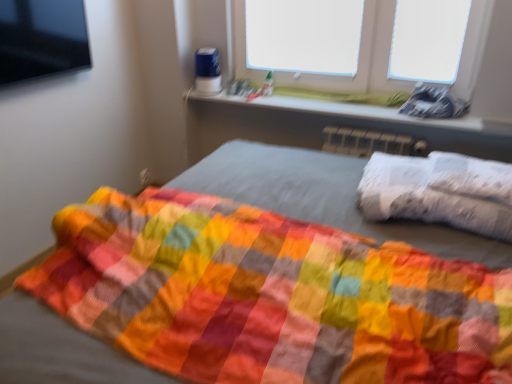
Question: Can you confirm if white matte window screen at upper center, the first window screen when ordered from left to right, is positioned to the left of white textured pillow at right?

Choices:
 (A) no
 (B) yes

Answer: (B)

Question: Is white matte window screen at upper center, the first window screen when ordered from left to right, bigger than white textured pillow at right?

Choices:
 (A) yes
 (B) no

Answer: (B)

Question: Does white matte window screen at upper center, the second window screen viewed from the right, come in front of white textured pillow at right?

Choices:
 (A) no
 (B) yes

Answer: (A)

Question: Is white matte window screen at upper center, the second window screen viewed from the right, completely or partially outside of white textured pillow at right?

Choices:
 (A) yes
 (B) no

Answer: (A)

Question: Is white matte window screen at upper center, the first window screen when ordered from left to right, touching white textured pillow at right?

Choices:
 (A) no
 (B) yes

Answer: (A)

Question: From the image's perspective, would you say white matte window screen at upper center, the second window screen viewed from the right, is shown under white textured pillow at right?

Choices:
 (A) yes
 (B) no

Answer: (B)

Question: Considering the relative sizes of white plastic window sill at upper center and white matte window screen at upper center, the second window screen viewed from the right, in the image provided, is white plastic window sill at upper center bigger than white matte window screen at upper center, the second window screen viewed from the right,?

Choices:
 (A) no
 (B) yes

Answer: (B)

Question: From the image's perspective, is white plastic window sill at upper center beneath white matte window screen at upper center, the first window screen when ordered from left to right?

Choices:
 (A) yes
 (B) no

Answer: (A)

Question: From a real-world perspective, is white plastic window sill at upper center on top of white matte window screen at upper center, the second window screen viewed from the right?

Choices:
 (A) yes
 (B) no

Answer: (B)

Question: Does white plastic window sill at upper center appear on the right side of white matte window screen at upper center, the first window screen when ordered from left to right?

Choices:
 (A) no
 (B) yes

Answer: (B)

Question: Is white plastic window sill at upper center thinner than white matte window screen at upper center, the second window screen viewed from the right?

Choices:
 (A) no
 (B) yes

Answer: (A)

Question: Is white plastic window sill at upper center looking in the opposite direction of white matte window screen at upper center, the second window screen viewed from the right?

Choices:
 (A) no
 (B) yes

Answer: (A)

Question: Considering the relative sizes of white matte window screen at upper center, the first window screen when ordered from left to right, and transparent plastic at upper right, arranged as the 2th window screen when viewed from the left, in the image provided, is white matte window screen at upper center, the first window screen when ordered from left to right, smaller than transparent plastic at upper right, arranged as the 2th window screen when viewed from the left,?

Choices:
 (A) yes
 (B) no

Answer: (B)